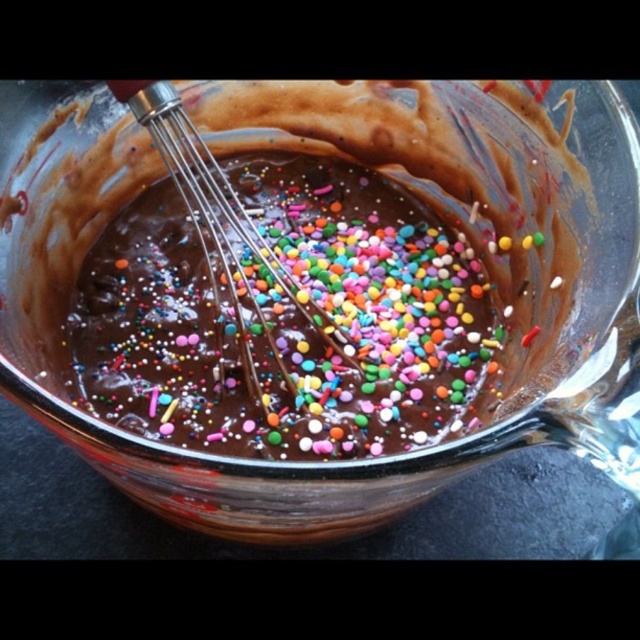
You are a chef standing at a counter and need to reach a point in the batter that is exactly at point coordinates point [369,100]. The counter is 3 feet away from you. Can you reach that point without moving your position?

The distance of point [369,100] from viewer is 15.92 inches, which is approximately 1.33 feet. Since the counter is 3 feet away from you, the point is within your reach if your arm length exceeds 1.33 feet. However, typical human arm length is about 2.5 feet, so yes, you can reach the point without moving.

You are a baker who needs to place a 10 cm wide spatula on the table next to the chocolatesmoothbowl at center. The table is 1 meter wide. If the bowl is at position 0.500 on the x axis, where should you place the spatula so it doesn

The chocolatesmoothbowl at center is located at x coordinate 0.500. To place the spatula next to it, position it at x coordinate 0.600 to ensure there is space between them.

You are a chef holding a spoon and want to reach the point at coordinates point (444, 474) in the glass mixing bowl. The bowl is 10 inches deep. Can you safely reach that point without spilling the batter?

The distance between the point (444, 474) and the camera is 8.53 inches, which is less than the bowl depth of 10 inches. Therefore, you can safely reach the point without spilling the batter.